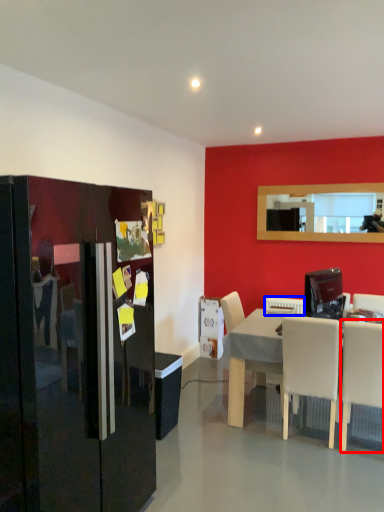
Question: Which of the following is the farthest to the observer, chair (highlighted by a red box) or appliance (highlighted by a blue box)?

Choices:
 (A) chair
 (B) appliance

Answer: (B)